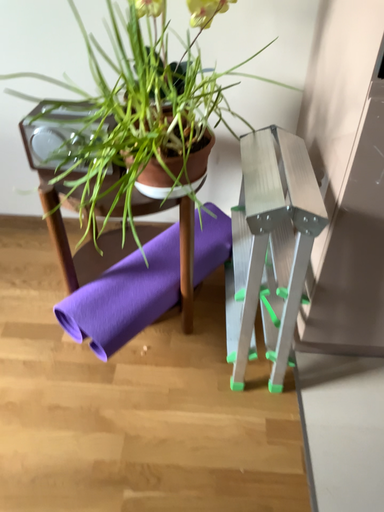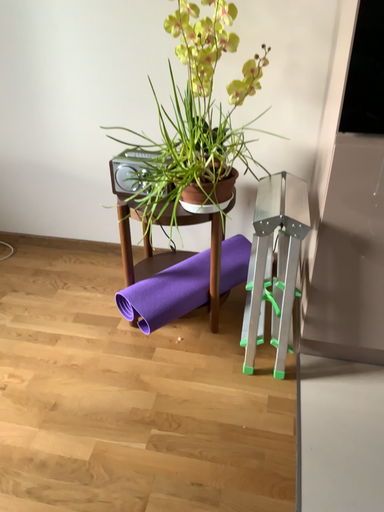
Question: How did the camera likely rotate when shooting the video?

Choices:
 (A) rotated right
 (B) rotated left

Answer: (B)